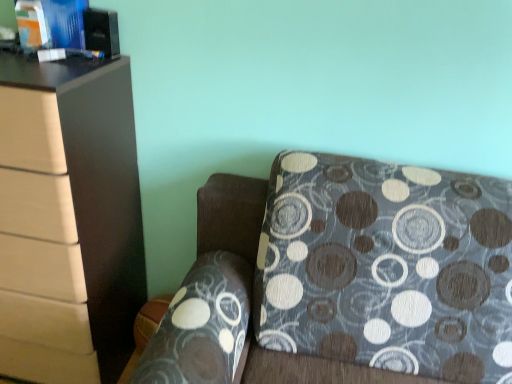
The height and width of the screenshot is (384, 512). Find the location of `free space in front of matte blue book at upper left, which appears as the 1th book when viewed from the left`. free space in front of matte blue book at upper left, which appears as the 1th book when viewed from the left is located at coordinates (26, 66).